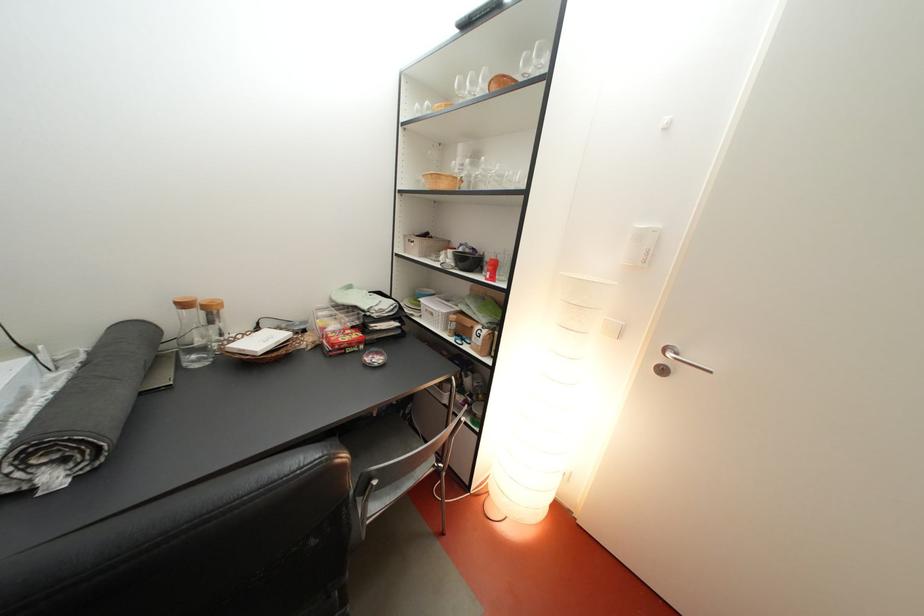
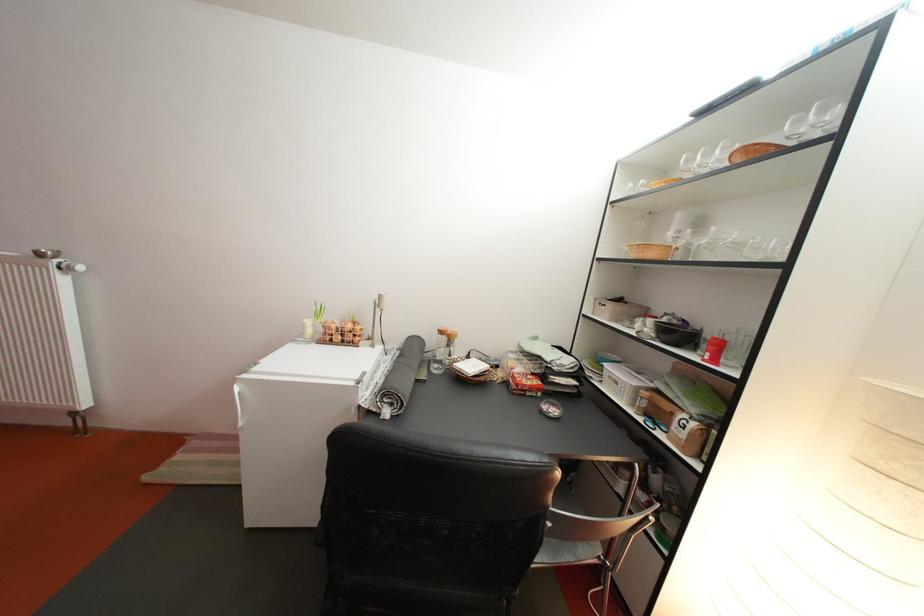
Locate, in the second image, the point that corresponds to [430,188] in the first image.

(630, 256)